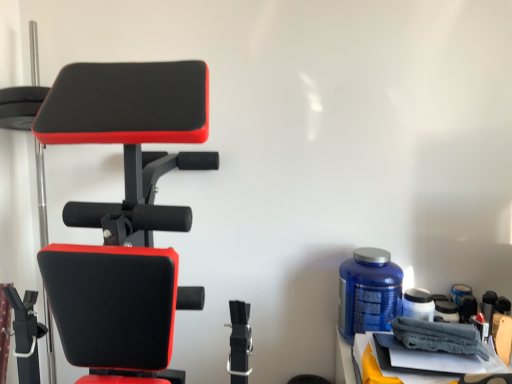
Question: Is blue plastic bottle at right aimed at gray fabric towel at lower right?

Choices:
 (A) no
 (B) yes

Answer: (B)

Question: Can you confirm if blue plastic bottle at right is bigger than gray fabric towel at lower right?

Choices:
 (A) yes
 (B) no

Answer: (A)

Question: Does blue plastic bottle at right have a lesser width compared to gray fabric towel at lower right?

Choices:
 (A) no
 (B) yes

Answer: (B)

Question: From a real-world perspective, is blue plastic bottle at right on gray fabric towel at lower right?

Choices:
 (A) yes
 (B) no

Answer: (A)

Question: Is blue plastic bottle at right positioned with its back to gray fabric towel at lower right?

Choices:
 (A) no
 (B) yes

Answer: (A)

Question: From a real-world perspective, relative to matte black exercise bench at left, is blue plastic bottle at right vertically above or below?

Choices:
 (A) above
 (B) below

Answer: (B)

Question: Considering the positions of point (371, 258) and point (159, 122), is point (371, 258) closer or farther from the camera than point (159, 122)?

Choices:
 (A) closer
 (B) farther

Answer: (B)

Question: From the image's perspective, is blue plastic bottle at right above or below matte black exercise bench at left?

Choices:
 (A) above
 (B) below

Answer: (B)

Question: Looking at the image, does blue plastic bottle at right seem bigger or smaller compared to matte black exercise bench at left?

Choices:
 (A) small
 (B) big

Answer: (A)

Question: From the image's perspective, relative to blue plastic bottle at right, is matte black exercise bench at left above or below?

Choices:
 (A) below
 (B) above

Answer: (B)

Question: Based on their positions, is matte black exercise bench at left located to the left or right of blue plastic bottle at right?

Choices:
 (A) left
 (B) right

Answer: (A)

Question: From a real-world perspective, is matte black exercise bench at left above or below blue plastic bottle at right?

Choices:
 (A) below
 (B) above

Answer: (B)

Question: Based on their sizes in the image, would you say matte black exercise bench at left is bigger or smaller than blue plastic bottle at right?

Choices:
 (A) big
 (B) small

Answer: (A)

Question: Is point (129, 110) positioned closer to the camera than point (352, 379)?

Choices:
 (A) farther
 (B) closer

Answer: (B)

Question: Considering their positions, is matte black exercise bench at left located in front of or behind gray fabric towel at lower right?

Choices:
 (A) front
 (B) behind

Answer: (A)